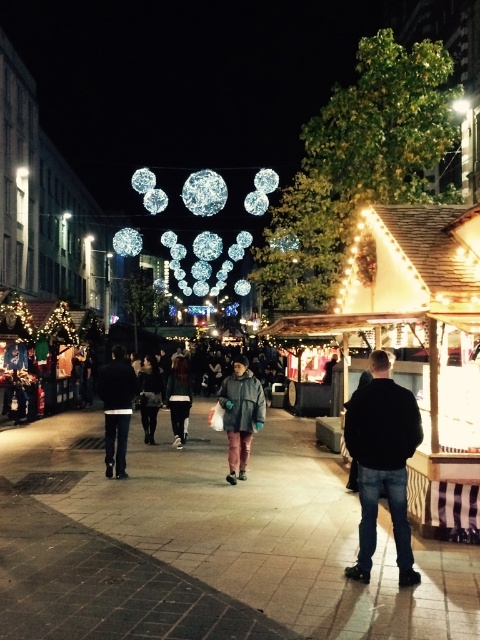
Between black matte jacket at center and dark gray jacket at center, which one appears on the right side from the viewer's perspective?

From the viewer's perspective, black matte jacket at center appears more on the right side.

Describe the element at coordinates (383, 461) in the screenshot. I see `black matte jacket at center` at that location.

Which is behind, point (365, 467) or point (145, 374)?

Point (145, 374)

The width and height of the screenshot is (480, 640). Find the location of `black matte jacket at center`. black matte jacket at center is located at coordinates (383, 461).

Does dark gray hoodie at center appear over dark gray jacket at center?

Yes.

Between point (173, 436) and point (144, 397), which one is positioned behind?

The point (173, 436) is behind.

Identify the location of dark gray hoodie at center. The height and width of the screenshot is (640, 480). (179, 397).

Between point (238, 424) and point (117, 387), which one is positioned behind?

Positioned behind is point (117, 387).

Is matte gray coat at center closer to camera compared to dark gray pants at center?

Yes, it is in front of dark gray pants at center.

Between point (257, 384) and point (115, 428), which one is positioned in front?

Point (257, 384)

Find the location of a particular element. This screenshot has width=480, height=640. matte gray coat at center is located at coordinates (240, 413).